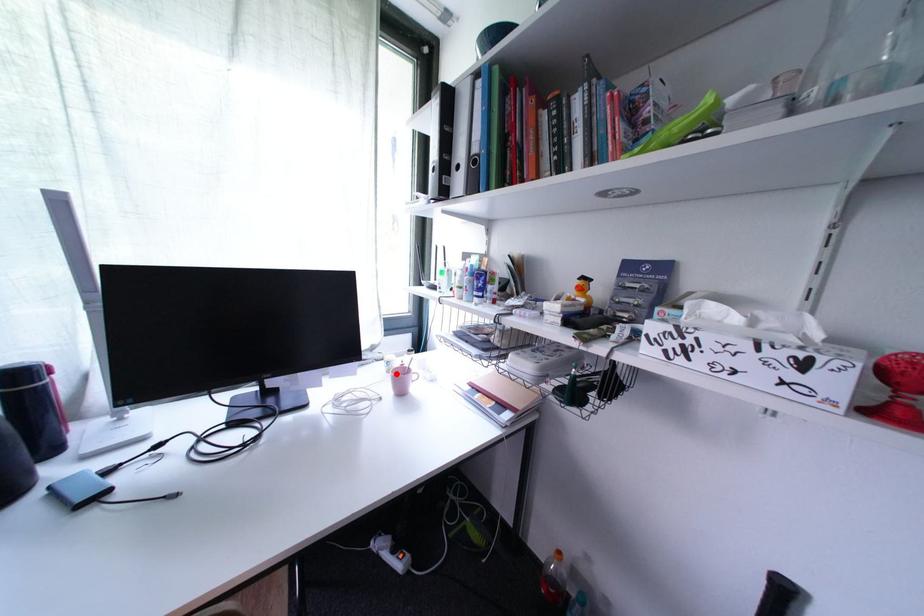
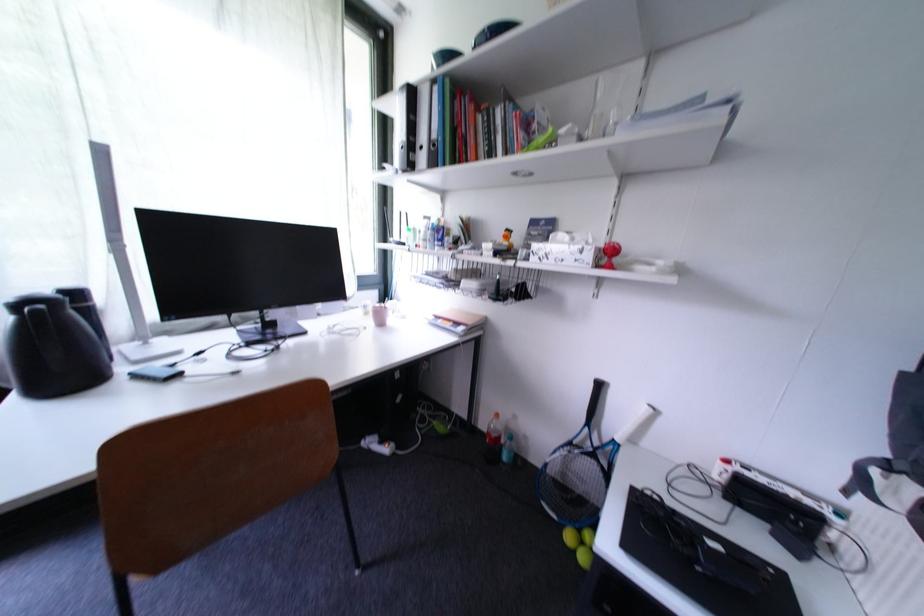
Where in the second image is the point corresponding to the highlighted location from the first image?

(373, 315)